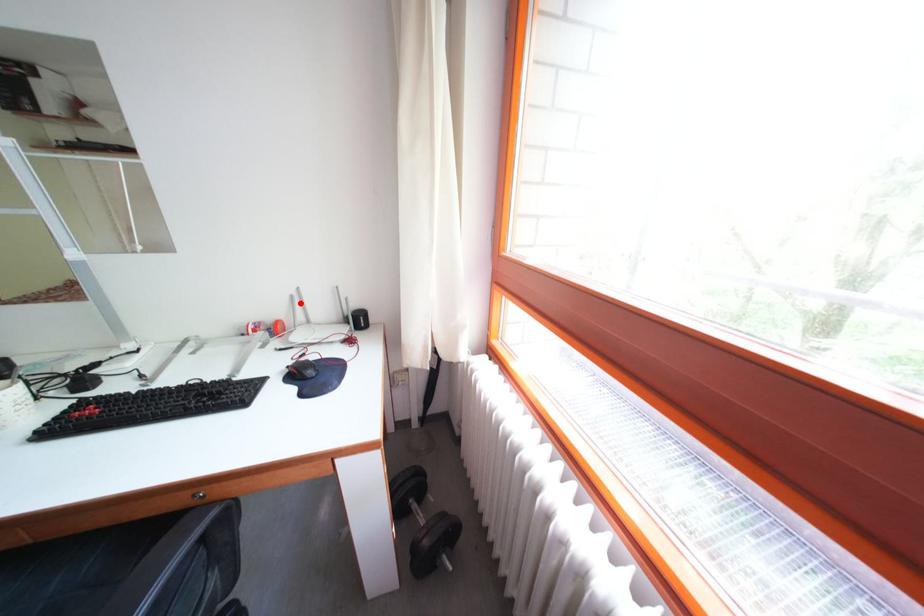
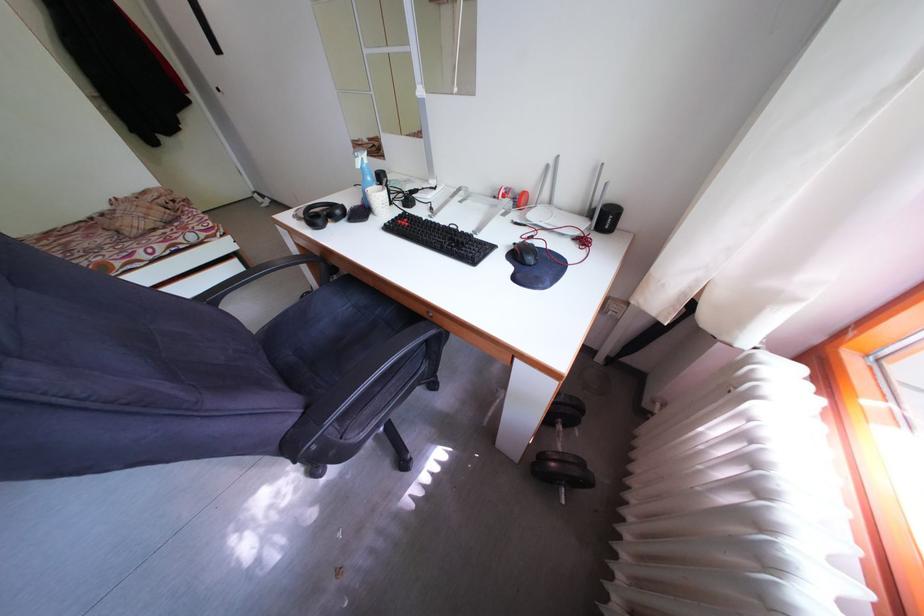
The point at the highlighted location is marked in the first image. Where is the corresponding point in the second image?

(555, 172)